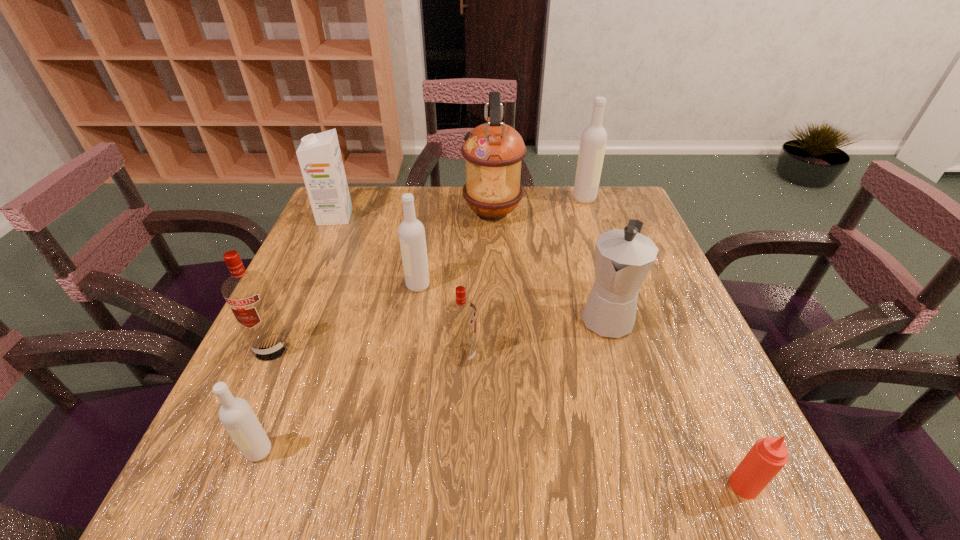
Find the location of a particular element. The image size is (960, 540). the nearest vodka is located at coordinates (236, 415).

Where is `the eighth farthest object`? the eighth farthest object is located at coordinates pyautogui.click(x=236, y=415).

Locate an element on the screen. This screenshot has width=960, height=540. the nearest object is located at coordinates (769, 455).

Identify the location of Tabasco sauce. pyautogui.click(x=769, y=455).

Find the location of a particular element. The height and width of the screenshot is (540, 960). free spot located 0.310m on the right of the oil lamp is located at coordinates (630, 213).

You are a GUI agent. You are given a task and a screenshot of the screen. Output one action in this format:
    pyautogui.click(x=<x>, y=<y>)
    Task: Click on the vacant area situated on the left of the tallest vodka
    The width and height of the screenshot is (960, 540).
    Given the screenshot: What is the action you would take?
    pyautogui.click(x=499, y=199)

Locate an element on the screen. vacant space located 0.200m on the right of the carton is located at coordinates (422, 217).

The image size is (960, 540). What are the coordinates of `vacant space located on the left of the coffeepot` in the screenshot? It's located at (446, 316).

You are a GUI agent. You are given a task and a screenshot of the screen. Output one action in this format:
    pyautogui.click(x=<x>, y=<y>)
    Task: Click on the vacant space located on the back of the third vodka from left to right
    
    Given the screenshot: What is the action you would take?
    pyautogui.click(x=422, y=259)

You are a GUI agent. You are given a task and a screenshot of the screen. Output one action in this format:
    pyautogui.click(x=<x>, y=<y>)
    Task: Click on the vacant space located 0.250m on the front label of the bigger red vodka
    The width and height of the screenshot is (960, 540).
    Given the screenshot: What is the action you would take?
    pyautogui.click(x=206, y=492)